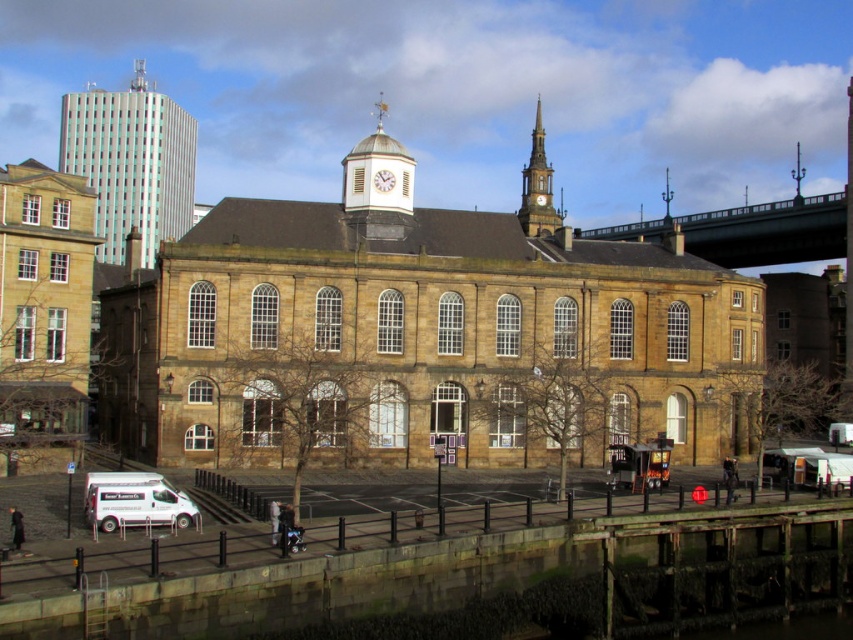
You are a city planner assessing the building layout. The metallic glass tower at upper left and the stone clock tower at upper center are both visible from the main street. Which tower would appear more prominent in the cityscape?

The metallic glass tower at upper left is larger in size than the stone clock tower at upper center, so it would appear more prominent in the cityscape.

You are standing in front of a historic building with a clock tower. There is a point marked at coordinates (444, 330). What does this point indicate?

The point at coordinates (444, 330) indicates the brown stone church at center.